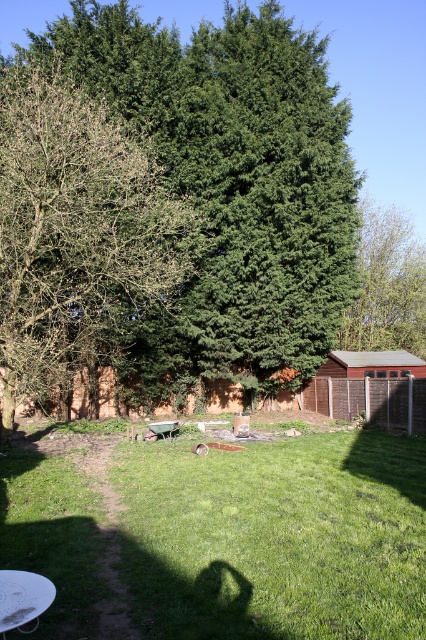
Question: Among these points, which one is nearest to the camera?

Choices:
 (A) (411, 243)
 (B) (48, 48)
 (C) (66, 262)

Answer: (C)

Question: Does bare branches at left have a lesser width compared to green leafy tree at upper center?

Choices:
 (A) yes
 (B) no

Answer: (A)

Question: Is green leafy tree at center wider than bare branches at left?

Choices:
 (A) yes
 (B) no

Answer: (A)

Question: Which point is farther from the camera taking this photo?

Choices:
 (A) (43, 381)
 (B) (405, 292)
 (C) (271, 36)

Answer: (B)

Question: Which of the following is the closest to the observer?

Choices:
 (A) (382, 260)
 (B) (131, 364)

Answer: (B)

Question: Where is green leafy tree at center located in relation to green leafy tree at upper center in the image?

Choices:
 (A) below
 (B) above

Answer: (B)